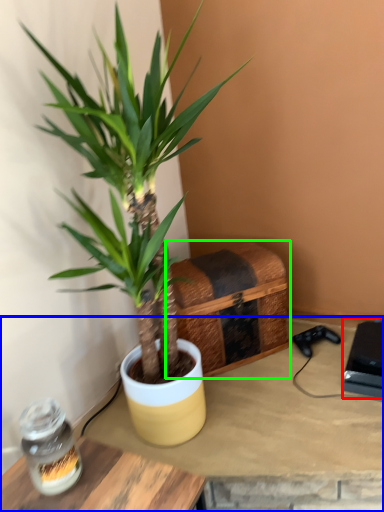
Question: Which is farther away from box (highlighted by a red box)? table (highlighted by a blue box) or crate (highlighted by a green box)?

Choices:
 (A) table
 (B) crate

Answer: (B)